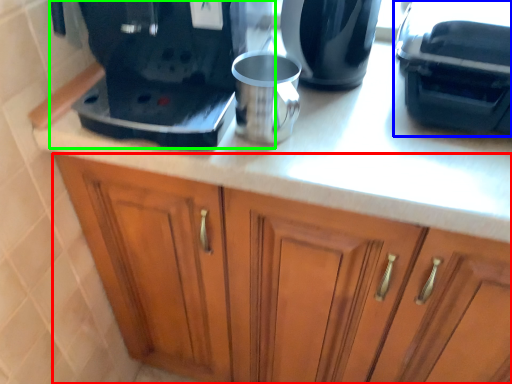
Question: Which object is positioned farthest from cabinetry (highlighted by a red box)? Select from coffee machine (highlighted by a blue box) and home appliance (highlighted by a green box).

Choices:
 (A) coffee machine
 (B) home appliance

Answer: (A)